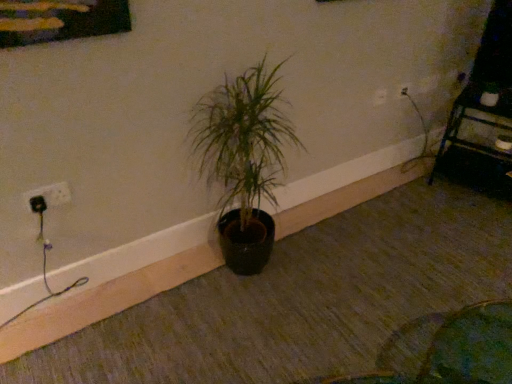
Question: Is metallic black shelf at upper right surrounding green matte plant at center?

Choices:
 (A) yes
 (B) no

Answer: (B)

Question: Can you confirm if metallic black shelf at upper right is positioned to the left of green matte plant at center?

Choices:
 (A) no
 (B) yes

Answer: (A)

Question: From a real-world perspective, is metallic black shelf at upper right physically below green matte plant at center?

Choices:
 (A) yes
 (B) no

Answer: (A)

Question: Can you confirm if metallic black shelf at upper right is shorter than green matte plant at center?

Choices:
 (A) yes
 (B) no

Answer: (A)

Question: From a real-world perspective, is metallic black shelf at upper right on green matte plant at center?

Choices:
 (A) no
 (B) yes

Answer: (A)

Question: Is point (506, 112) positioned closer to the camera than point (373, 102)?

Choices:
 (A) farther
 (B) closer

Answer: (A)

Question: Based on their sizes in the image, would you say metallic black shelf at upper right is bigger or smaller than white plastic electric outlet at upper right, acting as the second electric outlet starting from the front?

Choices:
 (A) big
 (B) small

Answer: (A)

Question: From a real-world perspective, relative to white plastic electric outlet at upper right, positioned as the 2th electric outlet in left-to-right order, is metallic black shelf at upper right vertically above or below?

Choices:
 (A) above
 (B) below

Answer: (B)

Question: Is metallic black shelf at upper right inside or outside of white plastic electric outlet at upper right, acting as the second electric outlet starting from the front?

Choices:
 (A) inside
 (B) outside

Answer: (B)

Question: Looking at their shapes, would you say green matte plant at center is wider or thinner than white plastic electric outlet at upper right, which is the 1th electric outlet in top-to-bottom order?

Choices:
 (A) wide
 (B) thin

Answer: (A)

Question: Looking at the image, does green matte plant at center seem bigger or smaller compared to white plastic electric outlet at upper right, which is the second electric outlet in bottom-to-top order?

Choices:
 (A) big
 (B) small

Answer: (A)

Question: Is point click(x=272, y=82) positioned closer to the camera than point click(x=375, y=92)?

Choices:
 (A) farther
 (B) closer

Answer: (B)

Question: In the image, is green matte plant at center positioned in front of or behind white plastic electric outlet at upper right, placed as the 1th electric outlet when sorted from back to front?

Choices:
 (A) front
 (B) behind

Answer: (A)

Question: Relative to white plastic socket at left, placed as the 2th electric outlet when sorted from right to left, is white plastic electric outlet at upper right, acting as the second electric outlet starting from the front, in front or behind?

Choices:
 (A) behind
 (B) front

Answer: (A)

Question: From the image's perspective, is white plastic electric outlet at upper right, which is the second electric outlet in bottom-to-top order, positioned above or below white plastic socket at left, placed as the second electric outlet when sorted from back to front?

Choices:
 (A) above
 (B) below

Answer: (A)